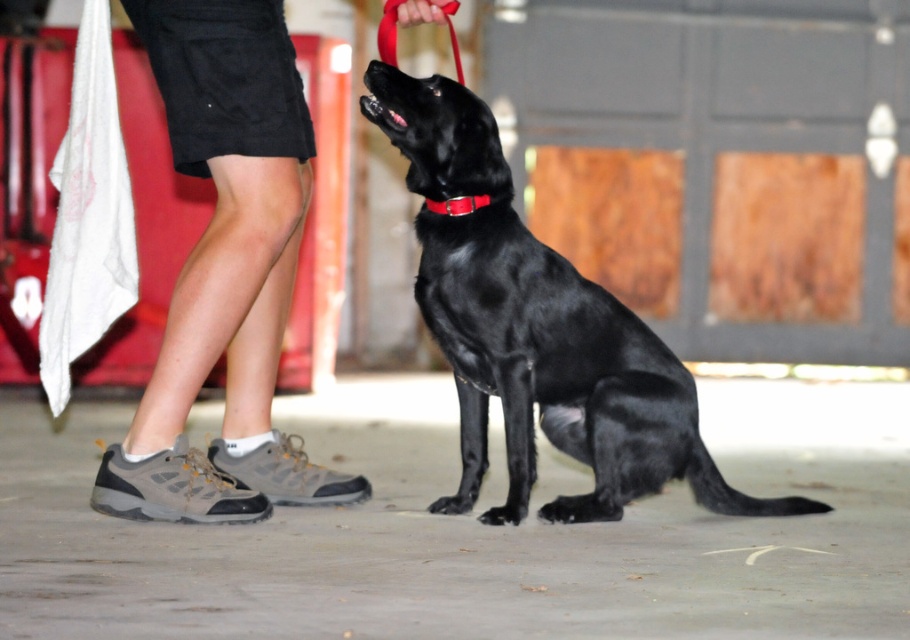
Who is shorter, red fabric leash at upper center or red leather collar at center?

red leather collar at center is shorter.

Does point (390, 10) come behind point (468, 195)?

Yes, point (390, 10) is farther from viewer.

You are a GUI agent. You are given a task and a screenshot of the screen. Output one action in this format:
    pyautogui.click(x=<x>, y=<y>)
    Task: Click on the red fabric leash at upper center
    The width and height of the screenshot is (910, 640).
    Given the screenshot: What is the action you would take?
    pyautogui.click(x=388, y=32)

Which is behind, point (467, 268) or point (486, 204)?

The point (486, 204) is behind.

Based on the photo, which is above, shiny black dog at center or red leather collar at center?

Positioned higher is red leather collar at center.

Locate an element on the screen. This screenshot has width=910, height=640. shiny black dog at center is located at coordinates (537, 332).

This screenshot has height=640, width=910. Describe the element at coordinates (225, 273) in the screenshot. I see `gray fabric shoe at lower left` at that location.

Which is more to the right, gray fabric shoe at lower left or red fabric leash at upper center?

red fabric leash at upper center is more to the right.

Locate an element on the screen. The image size is (910, 640). gray fabric shoe at lower left is located at coordinates (225, 273).

The image size is (910, 640). I want to click on gray fabric shoe at lower left, so click(225, 273).